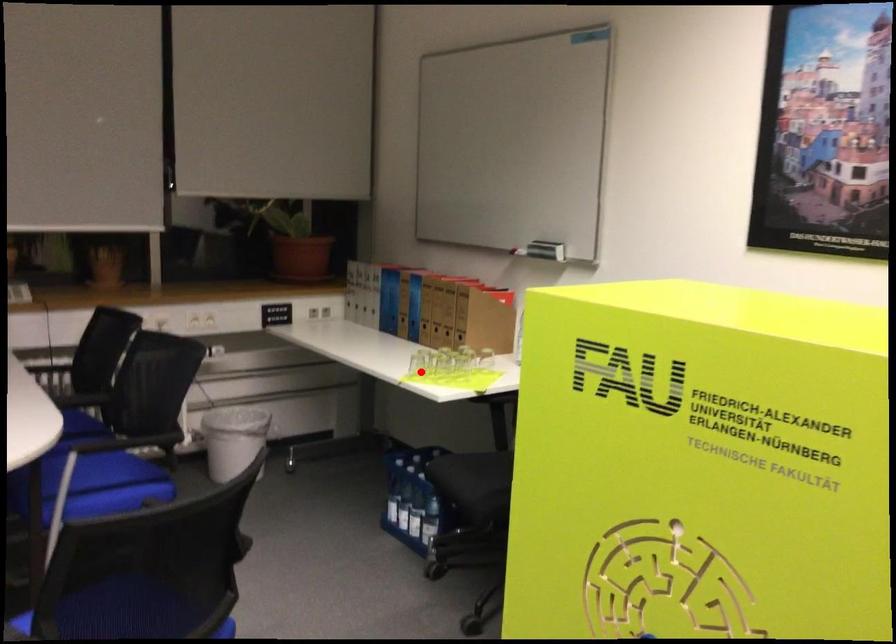
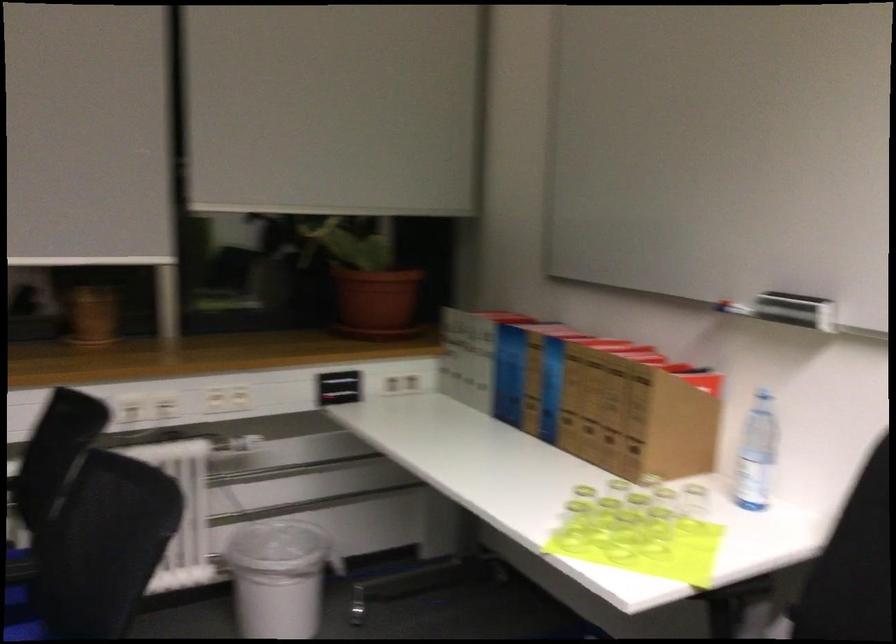
Question: I am providing you with two images of the same scene from different viewpoints. Given a red point in image1, look at the same physical point in image2. Is it:

Choices:
 (A) Closer to the viewpoint
 (B) Farther from the viewpoint

Answer: (A)